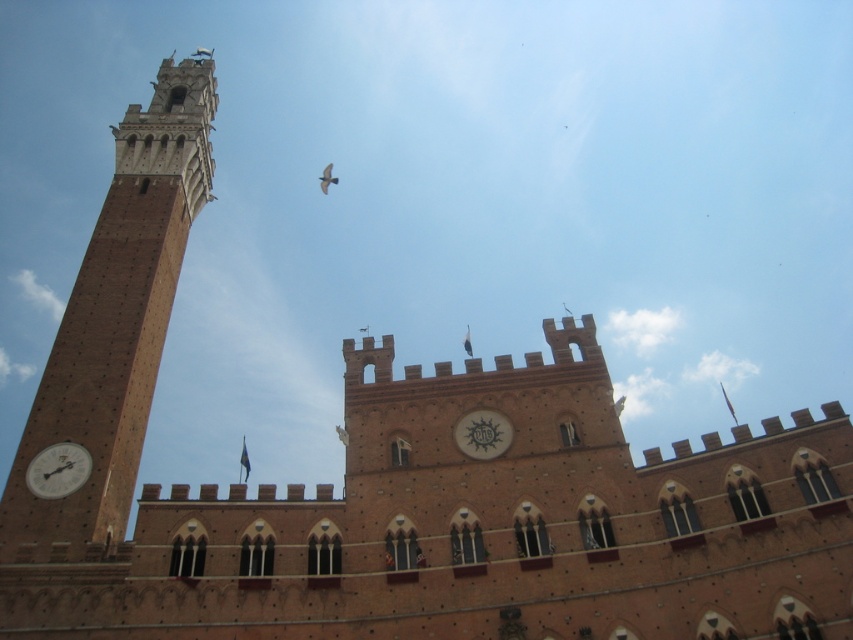
You are an architect examining the historic building. You notice the brown brick bell tower at left and the white glossy clock at center. Which structure is positioned further to the east?

The brown brick bell tower at left is to the left of the white glossy clock at center, so it is positioned further to the east since it is on the left side of the clock.

You are an architect examining the historic building. You need to determine which structure is taller between the brown brick bell tower at left and the white glossy clock at center. Based on the scene, which one is taller?

The brown brick bell tower at left is taller than the white glossy clock at center according to the description.

You are an architect examining the building facade. You notice two points marked on the image at coordinates point (53, 445) and point (476, 429). Which point is closer to the viewer?

Point (53, 445) is in front of point (476, 429), so it is closer to the viewer.